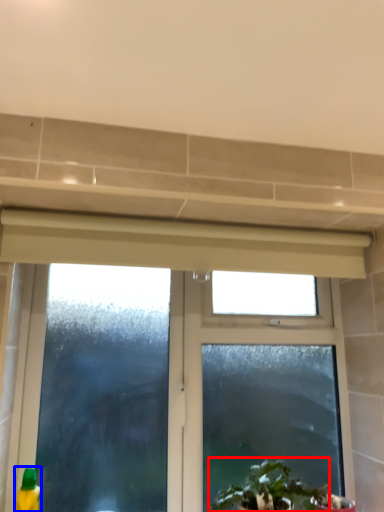
Question: Which object appears closest to the camera in this image, houseplant (highlighted by a red box) or cleaning product (highlighted by a blue box)?

Choices:
 (A) houseplant
 (B) cleaning product

Answer: (A)